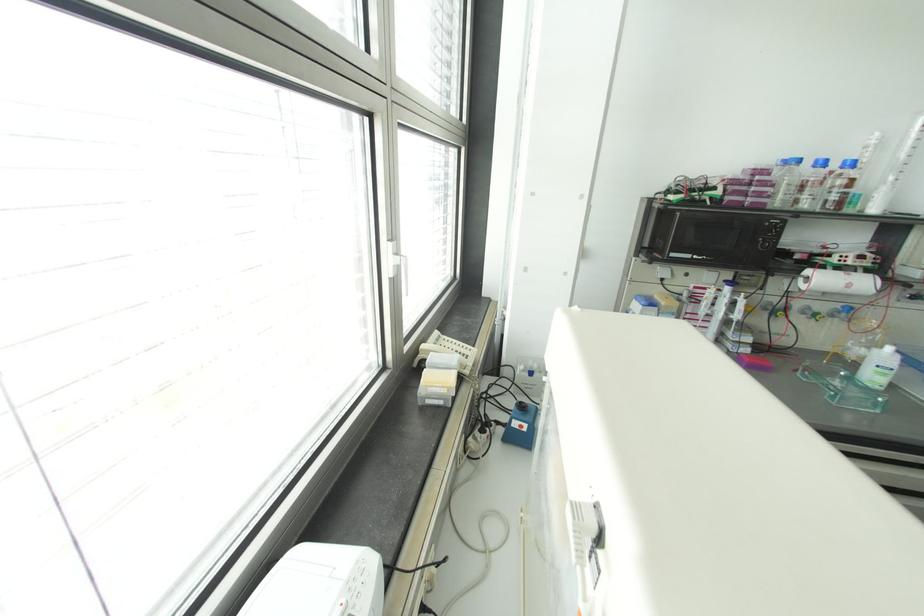
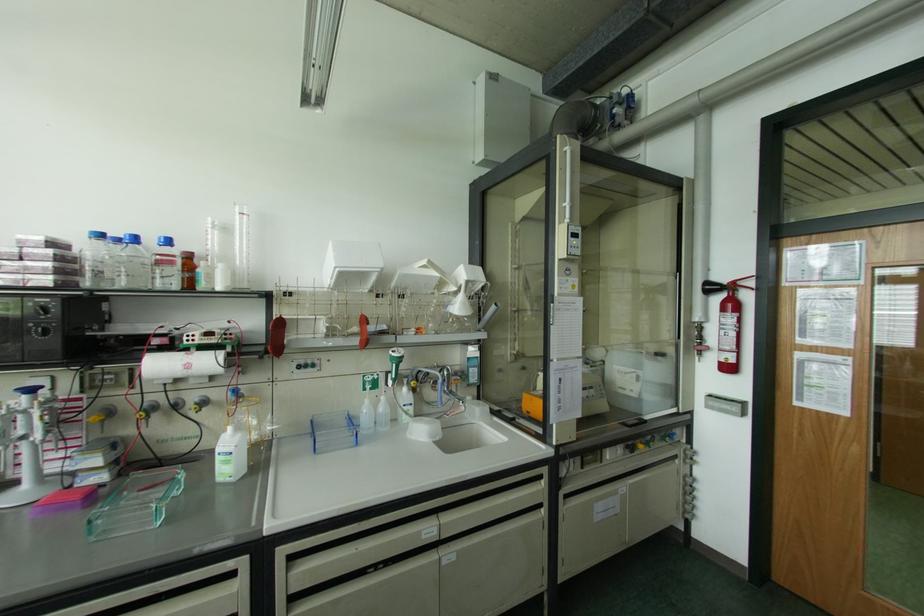
In the second image, find the point that corresponds to the point at 797,160 in the first image.

(101, 236)